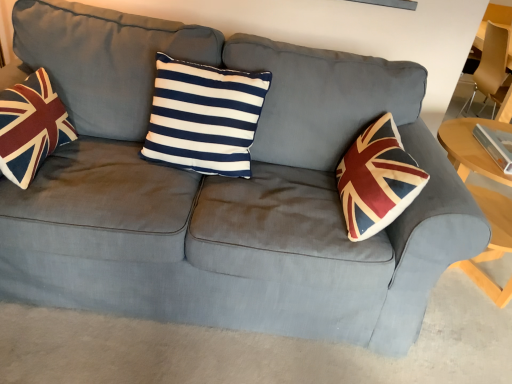
What is the approximate height of matte brown armchair at right?

matte brown armchair at right is 55.56 centimeters tall.

What is the approximate height of light wood table at right?

light wood table at right is 23.91 inches tall.

Locate an element on the screen. light wood table at right is located at coordinates (x=492, y=243).

Where is `navy/white striped cushion at center`? navy/white striped cushion at center is located at coordinates (204, 117).

Locate an element on the screen. velvet union jack pillow at left is located at coordinates (31, 127).

Is light wood table at right looking in the opposite direction of matte brown armchair at right?

Yes.

Considering the sizes of light wood table at right and matte brown armchair at right in the image, is light wood table at right bigger or smaller than matte brown armchair at right?

light wood table at right is bigger than matte brown armchair at right.

Based on the photo, is light wood table at right behind matte brown armchair at right?

No, light wood table at right is closer to the viewer.

Would you say light wood table at right contains matte brown armchair at right?

No.

Considering the relative positions of velvet union jack pillow at left and navy/white striped cushion at center in the image provided, is velvet union jack pillow at left behind navy/white striped cushion at center?

No, velvet union jack pillow at left is closer to the viewer.

Is velvet union jack pillow at left not inside navy/white striped cushion at center?

velvet union jack pillow at left is positioned outside navy/white striped cushion at center.

From the picture: From a real-world perspective, relative to navy/white striped cushion at center, is velvet union jack pillow at left vertically above or below?

velvet union jack pillow at left is situated lower than navy/white striped cushion at center in the real world.

Measure the distance from velvet union jack pillow at left to navy/white striped cushion at center.

They are 18.59 inches apart.

Where is `throw pillow that appears below the navy/white striped cushion at center (from a real-world perspective)`? This screenshot has height=384, width=512. throw pillow that appears below the navy/white striped cushion at center (from a real-world perspective) is located at coordinates (31, 127).

Which object is thinner, navy/white striped cushion at center or velvet union jack pillow at left?

navy/white striped cushion at center is thinner.

From the image's perspective, between navy/white striped cushion at center and velvet union jack pillow at left, which one is located above?

navy/white striped cushion at center is shown above in the image.

From the image's perspective, between navy/white striped cushion at center and matte brown armchair at right, who is located below?

navy/white striped cushion at center appears lower in the image.

Measure the distance between navy/white striped cushion at center and matte brown armchair at right.

navy/white striped cushion at center and matte brown armchair at right are 6.53 feet apart from each other.

Between navy/white striped cushion at center and matte brown armchair at right, which one has larger width?

Wider between the two is matte brown armchair at right.

From a real-world perspective, is matte brown armchair at right located beneath velvet union jack pillow at left?

Incorrect, from a real-world perspective, matte brown armchair at right is higher than velvet union jack pillow at left.

Is matte brown armchair at right in front of or behind velvet union jack pillow at left in the image?

matte brown armchair at right is behind velvet union jack pillow at left.

Considering the positions of objects matte brown armchair at right and velvet union jack pillow at left in the image provided, who is more to the right, matte brown armchair at right or velvet union jack pillow at left?

From the viewer's perspective, matte brown armchair at right appears more on the right side.

Who is taller, matte brown armchair at right or velvet union jack pillow at left?

matte brown armchair at right.

Is light wood table at right with velvet union jack pillow at left?

There is a gap between light wood table at right and velvet union jack pillow at left.

From the image's perspective, which object appears higher, light wood table at right or velvet union jack pillow at left?

velvet union jack pillow at left.

Looking at their sizes, would you say light wood table at right is wider or thinner than velvet union jack pillow at left?

Considering their sizes, light wood table at right looks broader than velvet union jack pillow at left.

Considering their positions, is light wood table at right located in front of or behind velvet union jack pillow at left?

Clearly, light wood table at right is behind velvet union jack pillow at left.

Can you confirm if velvet union jack pillow at left is thinner than matte brown armchair at right?

Yes, velvet union jack pillow at left is thinner than matte brown armchair at right.

Is velvet union jack pillow at left bigger or smaller than matte brown armchair at right?

velvet union jack pillow at left is smaller than matte brown armchair at right.

Is the position of velvet union jack pillow at left more distant than that of matte brown armchair at right?

No, velvet union jack pillow at left is closer to the camera.

Is velvet union jack pillow at left turned away from matte brown armchair at right?

No, velvet union jack pillow at left's orientation is not away from matte brown armchair at right.

The height and width of the screenshot is (384, 512). Find the location of `armchair above the light wood table at right (from the image's perspective)`. armchair above the light wood table at right (from the image's perspective) is located at coordinates (492, 68).

In order to click on pillow that is on the right side of velvet union jack pillow at left in this screenshot , I will do `click(204, 117)`.

Based on the photo, which object lies further to the anchor point velvet union jack pillow at left, matte brown armchair at right or light wood table at right?

Among the two, matte brown armchair at right is located further to velvet union jack pillow at left.

Based on their spatial positions, is light wood table at right or matte brown armchair at right further from velvet union jack pillow at left?

The object further to velvet union jack pillow at left is matte brown armchair at right.

From the image, which object appears to be nearer to velvet union jack pillow at left, navy/white striped cushion at center or matte brown armchair at right?

Among the two, navy/white striped cushion at center is located nearer to velvet union jack pillow at left.

Based on their spatial positions, is navy/white striped cushion at center or light wood table at right closer to velvet union jack pillow at left?

Based on the image, navy/white striped cushion at center appears to be nearer to velvet union jack pillow at left.

From the picture: From the image, which object appears to be farther from navy/white striped cushion at center, matte brown armchair at right or light wood table at right?

matte brown armchair at right is further to navy/white striped cushion at center.

Based on their spatial positions, is velvet union jack pillow at left or matte brown armchair at right further from light wood table at right?

velvet union jack pillow at left.

Looking at the image, which one is located further to velvet union jack pillow at left, matte brown armchair at right or navy/white striped cushion at center?

matte brown armchair at right lies further to velvet union jack pillow at left than the other object.

Estimate the real-world distances between objects in this image. Which object is further from light wood table at right, matte brown armchair at right or navy/white striped cushion at center?

navy/white striped cushion at center.

Find the location of a particular element. This screenshot has height=384, width=512. pillow located between velvet union jack pillow at left and light wood table at right in the left-right direction is located at coordinates (204, 117).

I want to click on table between velvet union jack pillow at left and matte brown armchair at right, so click(x=492, y=243).

Identify the location of table between navy/white striped cushion at center and matte brown armchair at right in the horizontal direction. The width and height of the screenshot is (512, 384). (492, 243).

Where is `pillow between velvet union jack pillow at left and matte brown armchair at right from left to right`? pillow between velvet union jack pillow at left and matte brown armchair at right from left to right is located at coordinates (204, 117).